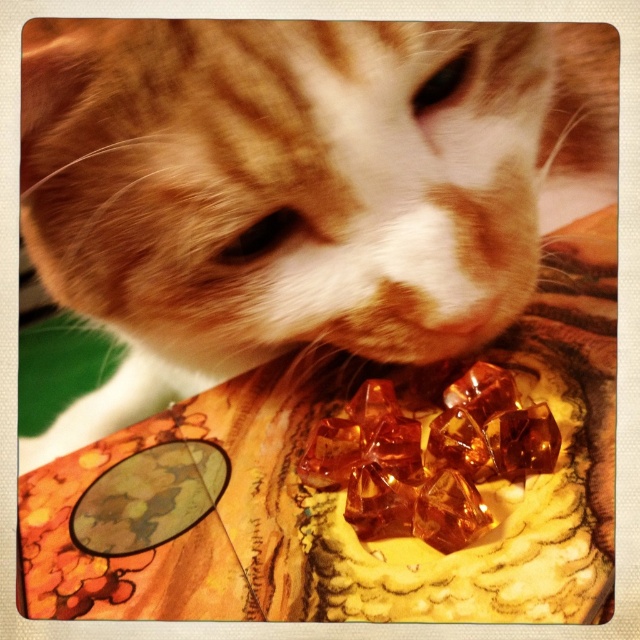
Consider the image. Is orange fur cat at center thinner than translucent amber cubes at center?

No, orange fur cat at center is not thinner than translucent amber cubes at center.

Locate an element on the screen. The image size is (640, 640). orange fur cat at center is located at coordinates (298, 188).

Which is behind, point (461, 257) or point (333, 452)?

Positioned behind is point (333, 452).

Image resolution: width=640 pixels, height=640 pixels. Identify the location of orange fur cat at center. (298, 188).